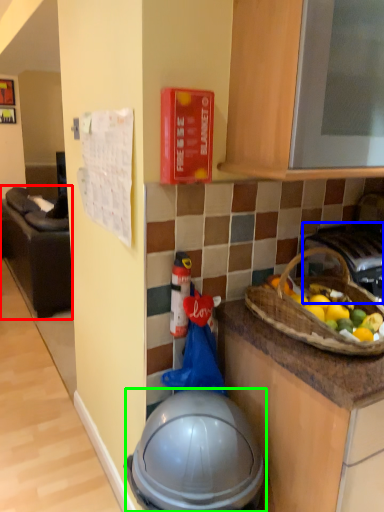
Question: Considering the real-world distances, which object is closest to furniture (highlighted by a red box)? gas stove (highlighted by a blue box) or helmet (highlighted by a green box).

Choices:
 (A) gas stove
 (B) helmet

Answer: (B)